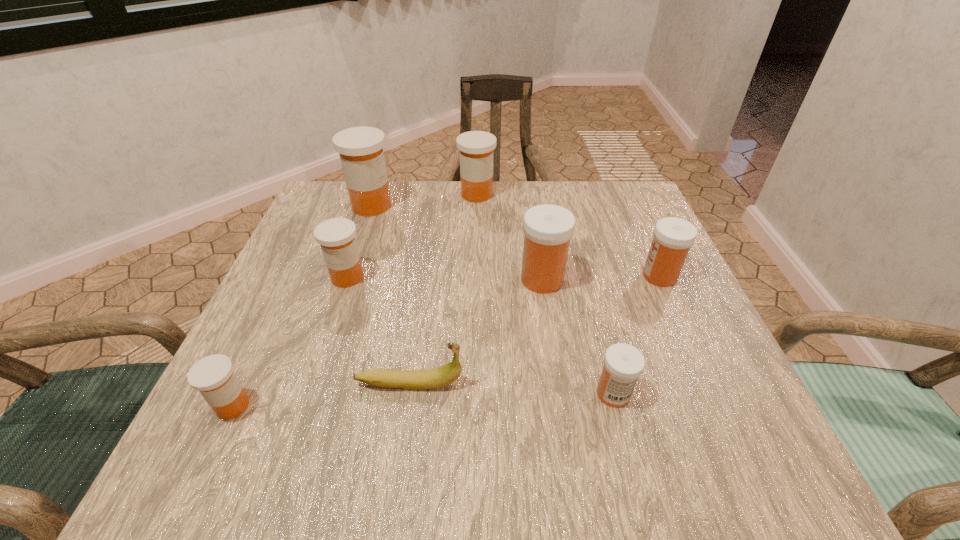
Identify the location of blank space located on the label of the smallest orange medicine. (361, 406).

Find the location of a particular element. free region located 0.240m on the back of the smallest white medicine is located at coordinates (584, 280).

Identify the location of object that is at the near edge. This screenshot has height=540, width=960. (213, 376).

Where is `object situated at the right edge`? The height and width of the screenshot is (540, 960). object situated at the right edge is located at coordinates (673, 237).

Find the location of a particular element. This screenshot has height=540, width=960. object located in the far left corner section of the desktop is located at coordinates (361, 153).

Find the location of a particular element. object located in the near left corner section of the desktop is located at coordinates (213, 376).

Identify the location of vacant area at the far edge of the desktop. The width and height of the screenshot is (960, 540). (399, 186).

This screenshot has height=540, width=960. Find the location of `free location at the near edge`. free location at the near edge is located at coordinates tap(532, 424).

Identify the location of free space at the left edge of the desktop. (325, 337).

In the image, there is a desktop. What are the coordinates of `free space at the right edge` in the screenshot? It's located at (713, 376).